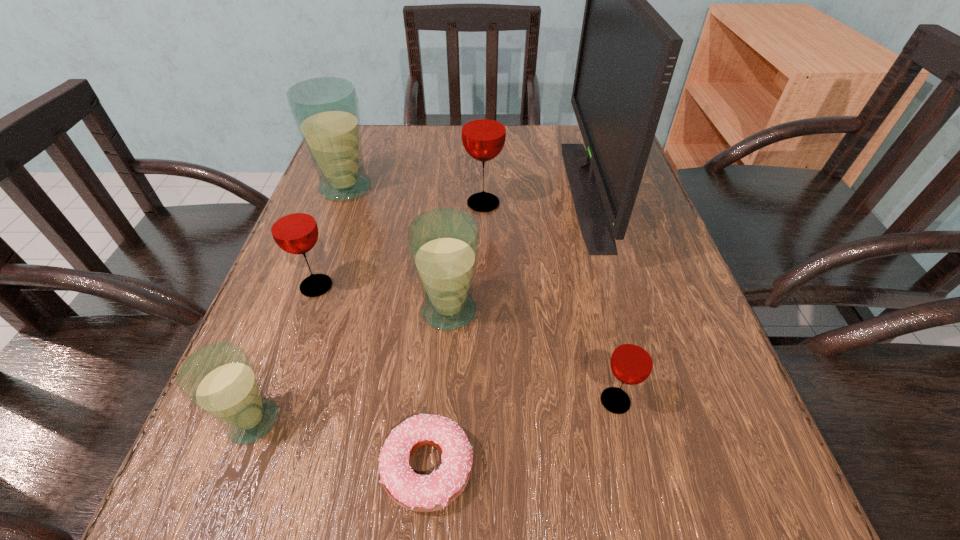
Locate which red glass is the closest to the smallest red glass. Please provide its 2D coordinates. Your answer should be formatted as a tuple, i.e. [(x, y)], where the tuple contains the x and y coordinates of a point satisfying the conditions above.

[(483, 127)]

Identify which blue glass is the second closest to the shortest object. Please provide its 2D coordinates. Your answer should be formatted as a tuple, i.e. [(x, y)], where the tuple contains the x and y coordinates of a point satisfying the conditions above.

[(443, 243)]

Point out which blue glass is positioned as the second nearest to the biggest blue glass. Please provide its 2D coordinates. Your answer should be formatted as a tuple, i.e. [(x, y)], where the tuple contains the x and y coordinates of a point satisfying the conditions above.

[(219, 379)]

You are a GUI agent. You are given a task and a screenshot of the screen. Output one action in this format:
    pyautogui.click(x=<x>, y=<y>)
    Task: Click on the vacant region that satisfies the following two spatial constraints: 1. on the front side of the farthest blue glass; 2. on the right side of the second red glass from left to right
    Image resolution: width=960 pixels, height=540 pixels.
    Given the screenshot: What is the action you would take?
    pyautogui.click(x=340, y=204)

Where is `vacant space that satisfies the following two spatial constraints: 1. on the front-facing side of the tallest object; 2. on the front side of the second biggest red glass`? This screenshot has height=540, width=960. vacant space that satisfies the following two spatial constraints: 1. on the front-facing side of the tallest object; 2. on the front side of the second biggest red glass is located at coordinates (612, 286).

Identify the location of vacant position in the image that satisfies the following two spatial constraints: 1. on the front side of the second red glass from left to right; 2. on the left side of the biggest blue glass. (340, 204).

I want to click on blank space that satisfies the following two spatial constraints: 1. on the back side of the shortest object; 2. on the left side of the second nearest blue glass, so click(441, 310).

Identify the location of free space that satisfies the following two spatial constraints: 1. on the front side of the doughnut; 2. on the left side of the second biggest red glass. This screenshot has width=960, height=540. (252, 467).